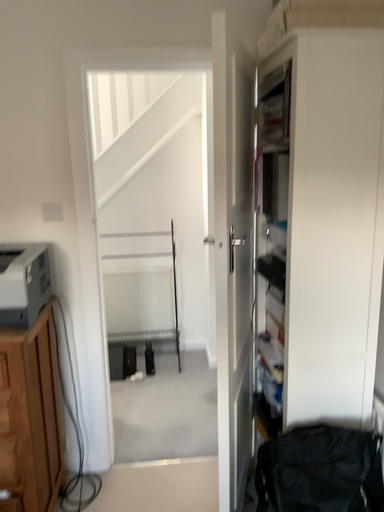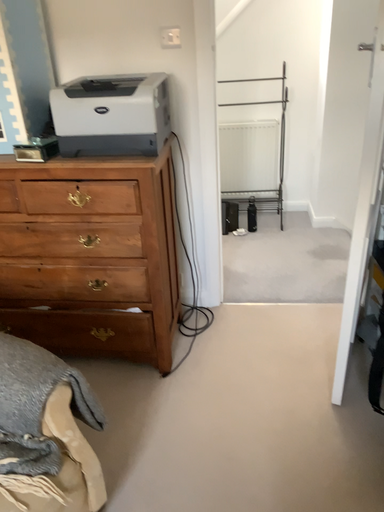
Question: Which way did the camera rotate in the video?

Choices:
 (A) rotated downward
 (B) rotated upward

Answer: (A)